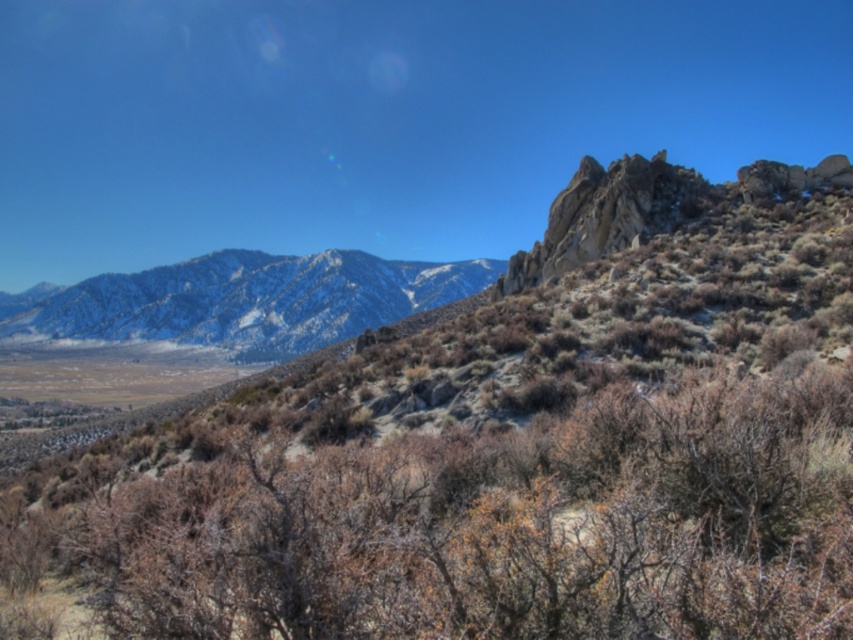
Question: Is brown textured shrub at center thinner than snowy rocky mountain range at upper left?

Choices:
 (A) no
 (B) yes

Answer: (B)

Question: Among these points, which one is nearest to the camera?

Choices:
 (A) click(x=206, y=342)
 (B) click(x=791, y=388)

Answer: (B)

Question: Among these points, which one is nearest to the camera?

Choices:
 (A) (338, 289)
 (B) (698, 577)

Answer: (B)

Question: In this image, where is brown textured shrub at center located relative to snowy rocky mountain range at upper left?

Choices:
 (A) below
 (B) above

Answer: (A)

Question: Which point is closer to the camera?

Choices:
 (A) brown textured shrub at center
 (B) snowy rocky mountain range at upper left

Answer: (A)

Question: Is brown textured shrub at center smaller than snowy rocky mountain range at upper left?

Choices:
 (A) no
 (B) yes

Answer: (B)